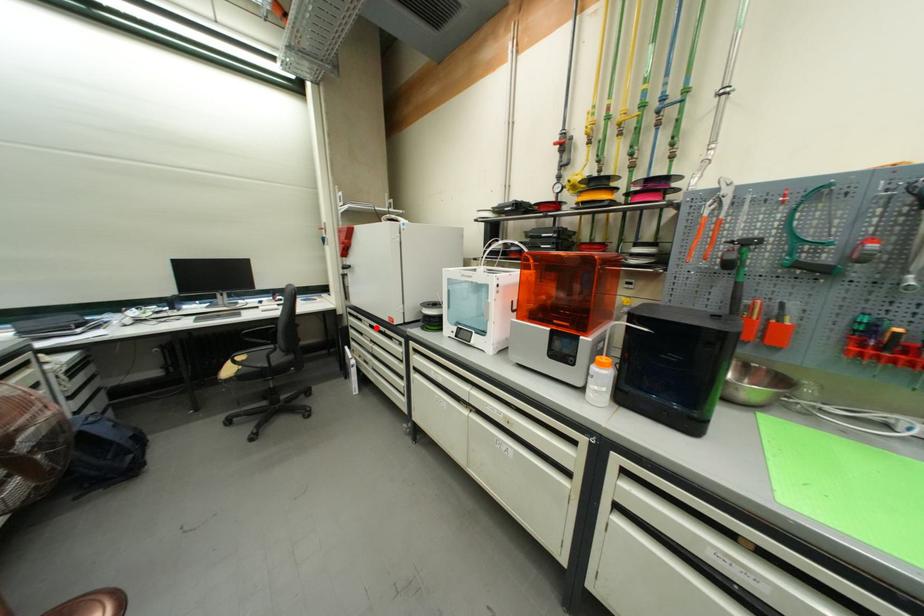
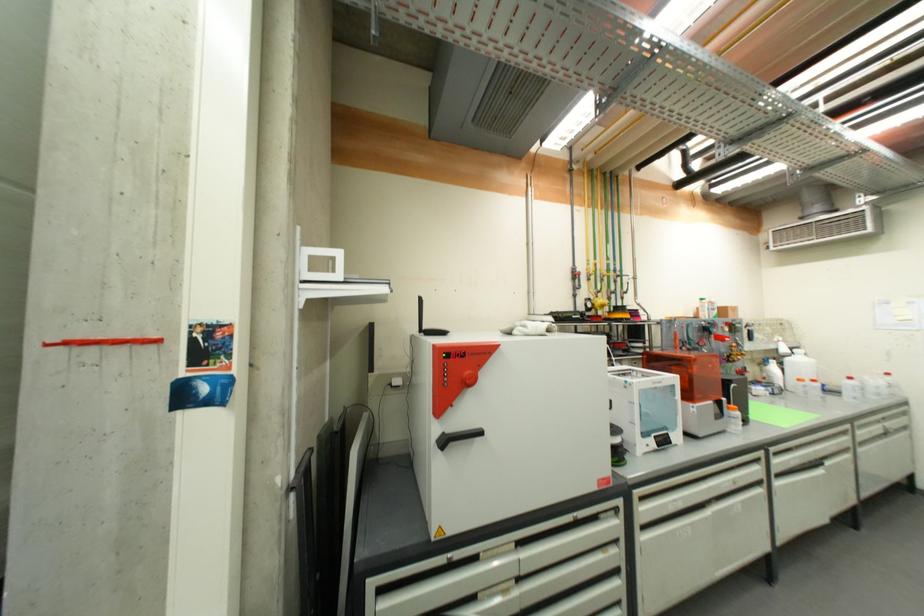
Find the pixel in the second image that matches the highlighted location in the first image.

(525, 546)